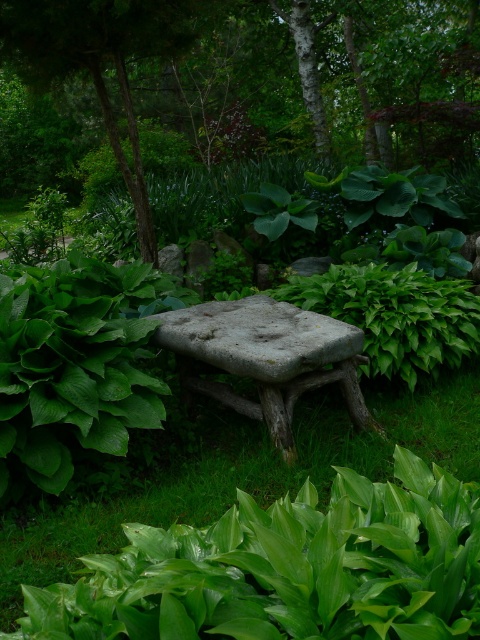
Consider the image. Can you confirm if green leafy tree at center is positioned to the left of green grass at center?

Correct, you'll find green leafy tree at center to the left of green grass at center.

Is point (414, 141) positioned behind point (476, 433)?

Yes, it is.

Where is `green leafy tree at center`? Image resolution: width=480 pixels, height=640 pixels. green leafy tree at center is located at coordinates (242, 81).

Can you confirm if green grass at center is wider than rough stone bench at center?

Yes.

Does green grass at center lie in front of rough stone bench at center?

Yes, green grass at center is in front of rough stone bench at center.

Who is more forward, (x=109, y=504) or (x=216, y=321)?

Point (x=109, y=504) is in front.

Locate an element on the screen. Image resolution: width=480 pixels, height=640 pixels. green grass at center is located at coordinates (187, 490).

Can you confirm if green leafy tree at center is taller than rough stone bench at center?

Yes, green leafy tree at center is taller than rough stone bench at center.

Locate an element on the screen. Image resolution: width=480 pixels, height=640 pixels. green leafy tree at center is located at coordinates (242, 81).

Find the location of a particular element. The height and width of the screenshot is (640, 480). green leafy tree at center is located at coordinates click(242, 81).